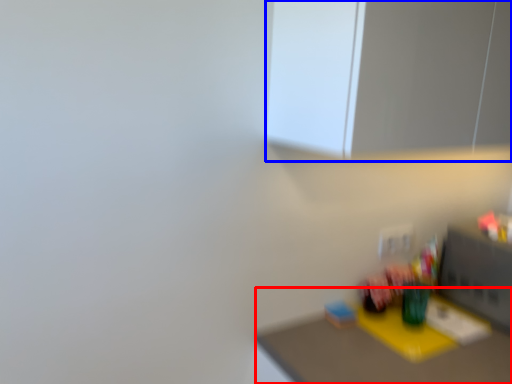
Question: Which of the following is the farthest to the observer, table (highlighted by a red box) or medicine cabinet (highlighted by a blue box)?

Choices:
 (A) table
 (B) medicine cabinet

Answer: (A)